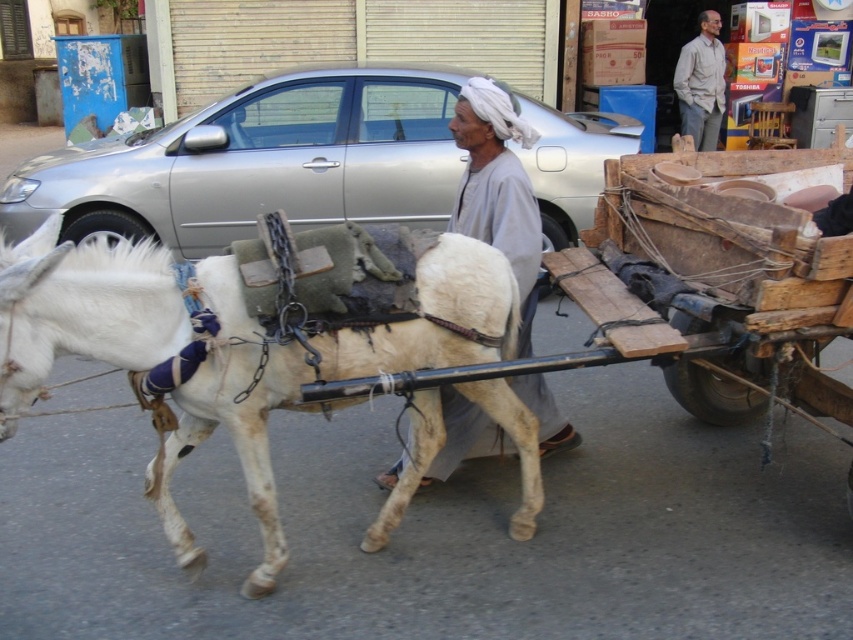
Question: Which point appears farthest from the camera in this image?

Choices:
 (A) (178, 248)
 (B) (560, 429)
 (C) (280, 374)

Answer: (A)

Question: Does white leather horse at center have a smaller size compared to gray cotton turban at center?

Choices:
 (A) yes
 (B) no

Answer: (B)

Question: Which point is farther to the camera?

Choices:
 (A) (339, 132)
 (B) (697, 76)
 (C) (525, 237)

Answer: (B)

Question: Estimate the real-world distances between objects in this image. Which object is farther from the light gray shirt at upper right?

Choices:
 (A) white leather horse at center
 (B) gray cotton turban at center
 (C) silver metallic car at center

Answer: (A)

Question: Is silver metallic car at center to the right of gray cotton turban at center from the viewer's perspective?

Choices:
 (A) yes
 (B) no

Answer: (B)

Question: Does gray cotton turban at center appear on the right side of light gray shirt at upper right?

Choices:
 (A) no
 (B) yes

Answer: (A)